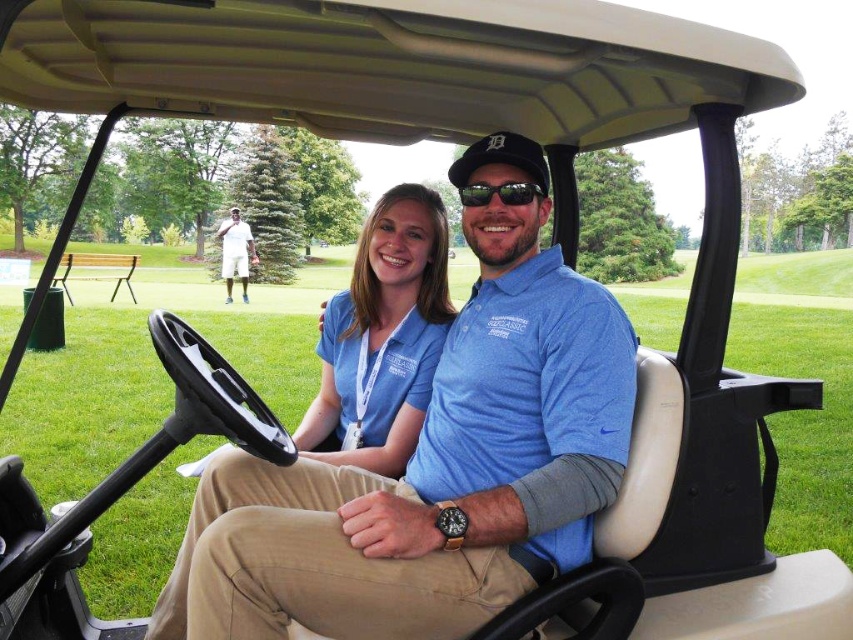
Question: Can you confirm if matte blue shirt at center is bigger than black plastic sunglasses at center?

Choices:
 (A) yes
 (B) no

Answer: (A)

Question: Based on their relative distances, which object is farther from the black plastic sunglasses at center?

Choices:
 (A) white cotton shorts at upper left
 (B) matte blue shirt at center

Answer: (A)

Question: Is blue cotton shirt at center positioned behind black plastic sunglasses at center?

Choices:
 (A) no
 (B) yes

Answer: (A)

Question: Can you confirm if blue cotton shirt at center is positioned above black plastic sunglasses at center?

Choices:
 (A) no
 (B) yes

Answer: (A)

Question: Which point appears farthest from the camera in this image?

Choices:
 (A) (358, 269)
 (B) (393, 602)
 (C) (239, 225)
 (D) (482, 184)

Answer: (C)

Question: Which of these objects is positioned farthest from the black plastic sunglasses at center?

Choices:
 (A) white cotton shorts at upper left
 (B) blue cotton shirt at center
 (C) matte blue shirt at center

Answer: (A)